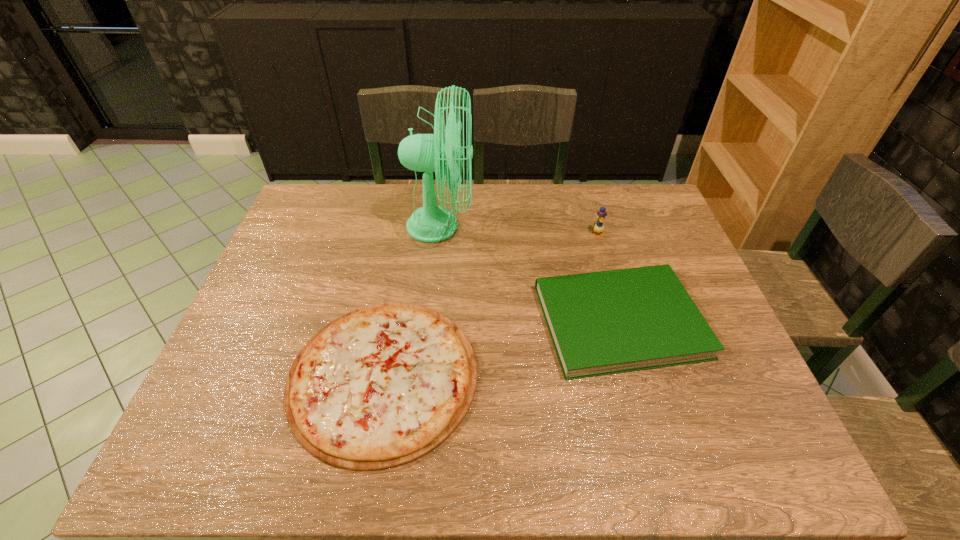
I want to click on fan, so click(x=431, y=223).

This screenshot has width=960, height=540. Find the location of `the second tallest object`. the second tallest object is located at coordinates pyautogui.click(x=598, y=227).

In order to click on paperback book in this screenshot , I will do `click(608, 322)`.

The image size is (960, 540). Find the location of `the shortest object`. the shortest object is located at coordinates (381, 386).

Image resolution: width=960 pixels, height=540 pixels. I want to click on vacant area situated 0.210m in front of the tallest object to blow air, so click(x=540, y=226).

At what (x,y) coordinates should I click in order to perform the action: click on free space located 0.060m on the face of the duckling, where the monocle is placed. Please return your answer as a coordinate pair (x, y). This screenshot has height=540, width=960. Looking at the image, I should click on (602, 249).

Locate an element on the screen. free spot located 0.300m on the left of the third tallest object is located at coordinates (421, 321).

Identify the location of vacant space located 0.310m on the right of the shortest object. This screenshot has height=540, width=960. (612, 376).

This screenshot has width=960, height=540. Identify the location of object at the far edge. (431, 223).

The image size is (960, 540). In order to click on object located at the near edge in this screenshot , I will do `click(381, 386)`.